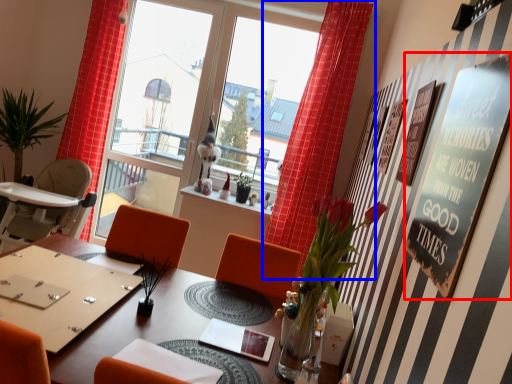
Question: Which point is closer to the camera, bulletin board (highlighted by a red box) or curtain (highlighted by a blue box)?

Choices:
 (A) bulletin board
 (B) curtain

Answer: (A)